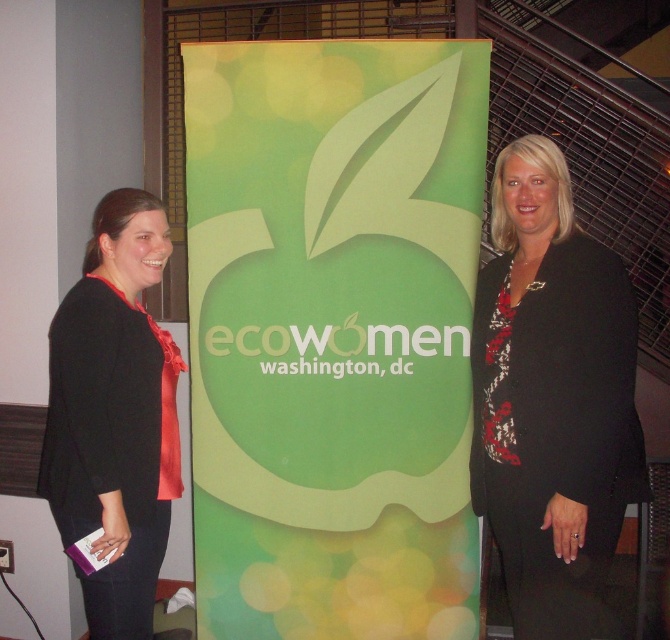
Does black textured blazer at right have a greater width compared to black satin blouse at left?

Correct, the width of black textured blazer at right exceeds that of black satin blouse at left.

Is point (500, 332) closer to camera compared to point (131, 289)?

Yes.

Where is `black textured blazer at right`? The width and height of the screenshot is (670, 640). black textured blazer at right is located at coordinates (551, 397).